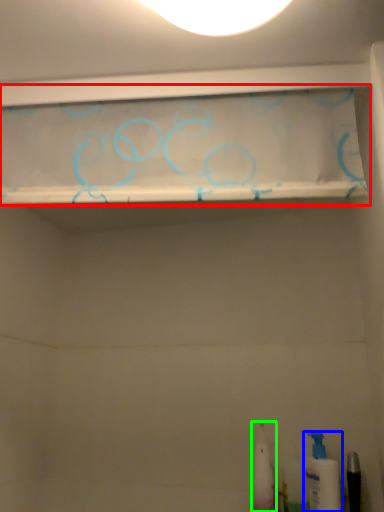
Question: Which is farther away from shelf (highlighted by a red box)? toiletry (highlighted by a blue box) or toiletry (highlighted by a green box)?

Choices:
 (A) toiletry
 (B) toiletry

Answer: (A)